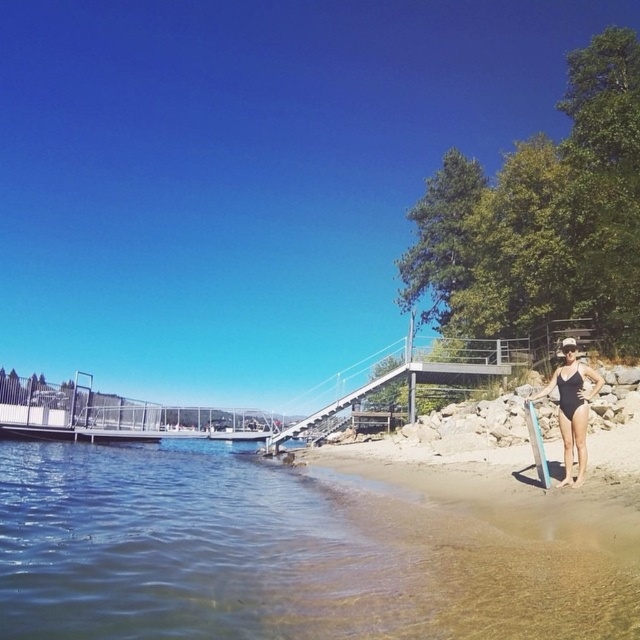
This screenshot has width=640, height=640. Describe the element at coordinates (156, 541) in the screenshot. I see `clear blue water at lower left` at that location.

Identify the location of clear blue water at lower left. click(156, 541).

Is black matte swimsuit at lower right closer to camera compared to blue plastic surfboard at right?

Yes, black matte swimsuit at lower right is in front of blue plastic surfboard at right.

Can you confirm if black matte swimsuit at lower right is wider than blue plastic surfboard at right?

Yes.

In order to click on black matte swimsuit at lower right in this screenshot , I will do `click(572, 406)`.

Between clear blue water at lower left and blue plastic surfboard at right, which one is positioned higher?

blue plastic surfboard at right is higher up.

At what (x,y) coordinates should I click in order to perform the action: click on clear blue water at lower left. Please return your answer as a coordinate pair (x, y). Looking at the image, I should click on (156, 541).

Where is `clear blue water at lower left`? clear blue water at lower left is located at coordinates (156, 541).

Find the location of a particular element. This screenshot has height=640, width=640. clear blue water at lower left is located at coordinates (156, 541).